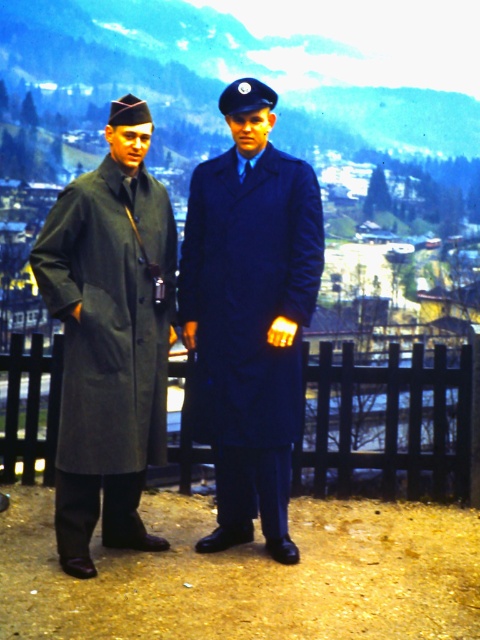
Which is above, matte gray coat at left or black wooden fence at center?

Positioned higher is matte gray coat at left.

Can you confirm if matte gray coat at left is positioned above black wooden fence at center?

Indeed, matte gray coat at left is positioned over black wooden fence at center.

What do you see at coordinates (109, 317) in the screenshot? I see `matte gray coat at left` at bounding box center [109, 317].

Where is `matte gray coat at left`? The height and width of the screenshot is (640, 480). matte gray coat at left is located at coordinates (109, 317).

Who is positioned more to the left, matte blue coat at center or matte gray coat at left?

matte gray coat at left is more to the left.

Is matte blue coat at center positioned in front of matte gray coat at left?

No, it is not.

You are a GUI agent. You are given a task and a screenshot of the screen. Output one action in this format:
    pyautogui.click(x=<x>, y=<y>)
    Task: Click on the matte blue coat at center
    
    Given the screenshot: What is the action you would take?
    pyautogui.click(x=250, y=314)

Locate an element on the screen. The width and height of the screenshot is (480, 640). matte blue coat at center is located at coordinates (250, 314).

Who is more distant from viewer, (236, 520) or (193, 173)?

The point (236, 520) is more distant.

Between matte gray coat at center and matte blue coat at center, which one appears on the right side from the viewer's perspective?

matte blue coat at center

Is point (238, 464) in front of point (255, 120)?

No, (238, 464) is further to viewer.

This screenshot has height=640, width=480. In order to click on matte gray coat at center in this screenshot , I will do `click(250, 314)`.